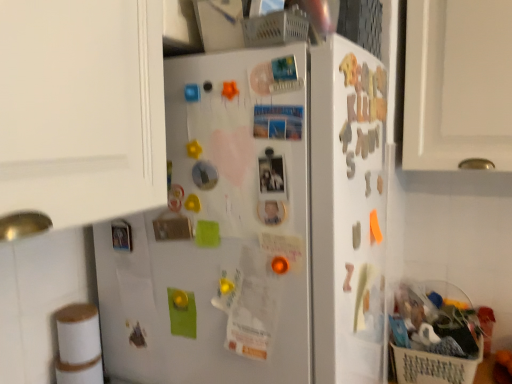
Question: Does gold metallic magnet at upper right, the sixth magnet when ordered from right to left, have a greater width compared to yellow rubber at upper center, which is the tenth magnet from right to left?

Choices:
 (A) no
 (B) yes

Answer: (B)

Question: Is gold metallic magnet at upper right, the sixth magnet when ordered from right to left, to the right of yellow rubber at upper center, which is the tenth magnet from right to left, from the viewer's perspective?

Choices:
 (A) yes
 (B) no

Answer: (A)

Question: From the image's perspective, is gold metallic magnet at upper right, the sixth magnet when ordered from right to left, over yellow rubber at upper center, which is the tenth magnet from right to left?

Choices:
 (A) no
 (B) yes

Answer: (B)

Question: Is the surface of gold metallic magnet at upper right, which ranks as the eighth magnet in left-to-right order, in direct contact with yellow rubber at upper center, which is the tenth magnet from right to left?

Choices:
 (A) no
 (B) yes

Answer: (A)

Question: Is gold metallic magnet at upper right, which ranks as the eighth magnet in left-to-right order, positioned behind yellow rubber at upper center, which is the tenth magnet from right to left?

Choices:
 (A) no
 (B) yes

Answer: (A)

Question: Is point (263, 195) positioned closer to the camera than point (352, 236)?

Choices:
 (A) closer
 (B) farther

Answer: (A)

Question: Is metallic silver button at center, the first button viewed from the top, inside or outside of matte silver magnet at right, which ranks as the 3th magnet in right-to-left order?

Choices:
 (A) outside
 (B) inside

Answer: (A)

Question: Considering the relative positions of metallic silver button at center, the first button viewed from the top, and matte silver magnet at right, which ranks as the 3th magnet in right-to-left order, in the image provided, is metallic silver button at center, the first button viewed from the top, to the left or to the right of matte silver magnet at right, which ranks as the 3th magnet in right-to-left order,?

Choices:
 (A) right
 (B) left

Answer: (B)

Question: Relative to matte silver magnet at right, which ranks as the 3th magnet in right-to-left order, is metallic silver button at center, the first button viewed from the top, in front or behind?

Choices:
 (A) front
 (B) behind

Answer: (A)

Question: Considering the positions of metallic silver magnet at upper right, positioned as the fifth magnet in right-to-left order, and bamboo toilet paper at lower left in the image, is metallic silver magnet at upper right, positioned as the fifth magnet in right-to-left order, bigger or smaller than bamboo toilet paper at lower left?

Choices:
 (A) small
 (B) big

Answer: (A)

Question: From a real-world perspective, is metallic silver magnet at upper right, marked as the 9th magnet in a left-to-right arrangement, physically located above or below bamboo toilet paper at lower left?

Choices:
 (A) above
 (B) below

Answer: (A)

Question: Is point [345, 129] positioned closer to the camera than point [69, 342]?

Choices:
 (A) closer
 (B) farther

Answer: (A)

Question: Relative to bamboo toilet paper at lower left, is metallic silver magnet at upper right, marked as the 9th magnet in a left-to-right arrangement, in front or behind?

Choices:
 (A) front
 (B) behind

Answer: (A)

Question: From the image's perspective, is orange matte magnet at upper center, the eighth magnet in the right-to-left sequence, above or below white matte refrigerator at center?

Choices:
 (A) below
 (B) above

Answer: (B)

Question: Based on their sizes in the image, would you say orange matte magnet at upper center, the eighth magnet in the right-to-left sequence, is bigger or smaller than white matte refrigerator at center?

Choices:
 (A) big
 (B) small

Answer: (B)